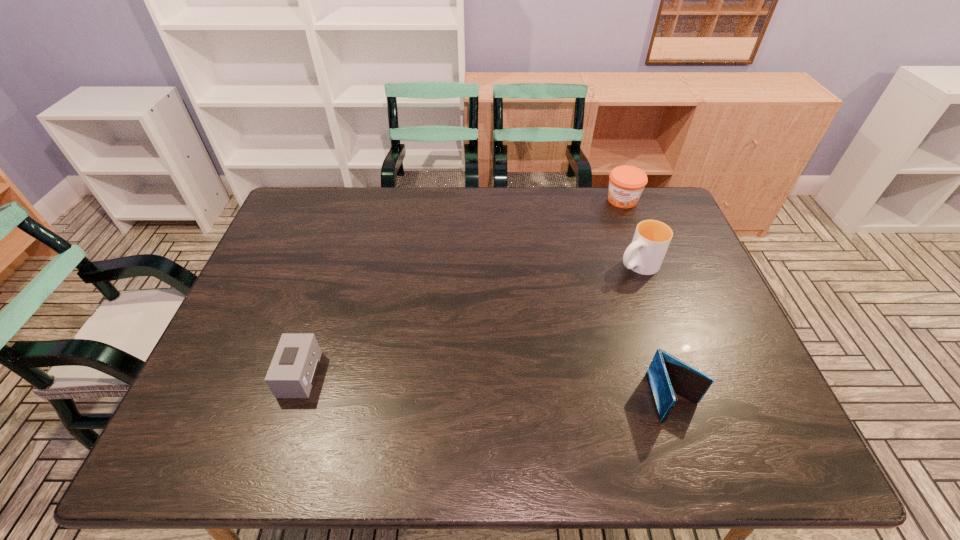
The width and height of the screenshot is (960, 540). In order to click on vacant space located with the handle on the side of the cup in this screenshot , I will do coord(557,309).

Find the location of a particular element. This screenshot has width=960, height=540. vacant region located on the front label of the jam is located at coordinates (581, 284).

The image size is (960, 540). I want to click on free location located 0.150m on the front label of the jam, so click(x=605, y=235).

Identify the location of free space located 0.360m on the front label of the jam. (584, 277).

Where is `object that is at the far edge`? object that is at the far edge is located at coordinates (626, 183).

Where is `alarm clock that is positioned at the near edge`? The width and height of the screenshot is (960, 540). alarm clock that is positioned at the near edge is located at coordinates (292, 372).

The image size is (960, 540). Identify the location of wallet at the near edge. (667, 375).

Locate an element on the screen. This screenshot has height=540, width=960. wallet at the right edge is located at coordinates (667, 375).

Where is `cup that is at the right edge`? The width and height of the screenshot is (960, 540). cup that is at the right edge is located at coordinates (645, 254).

Where is `jam positioned at the right edge`? Image resolution: width=960 pixels, height=540 pixels. jam positioned at the right edge is located at coordinates (626, 183).